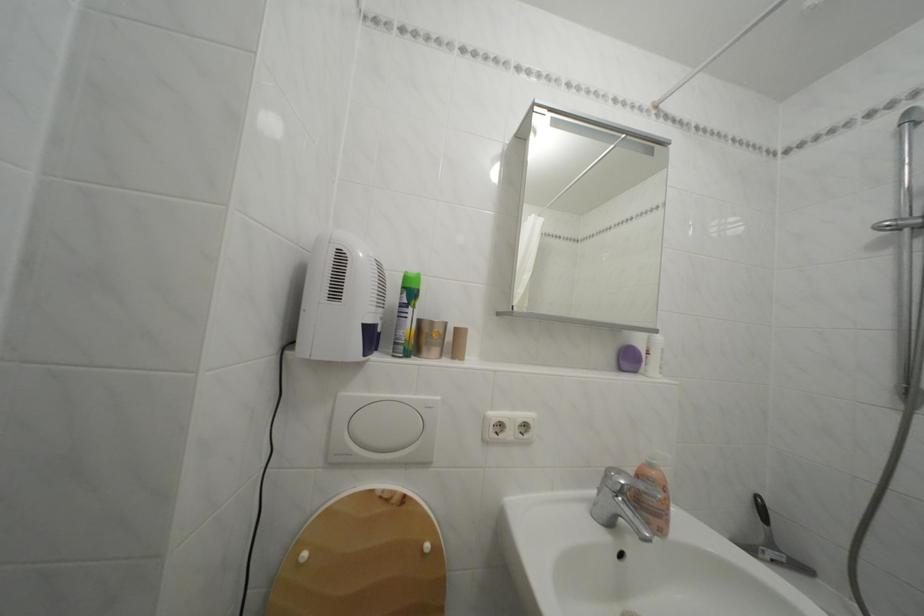
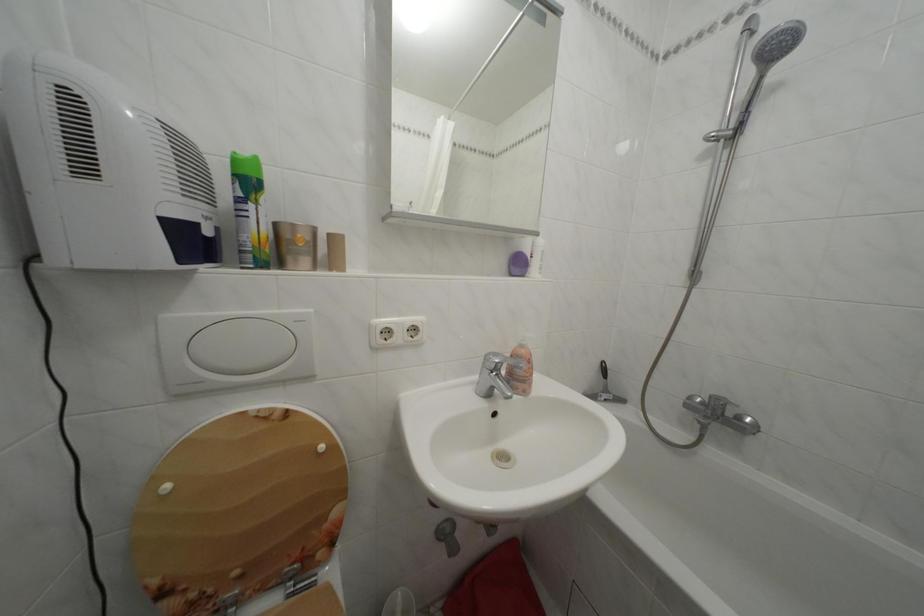
The point at (782,553) is marked in the first image. Where is the corresponding point in the second image?

(614, 397)